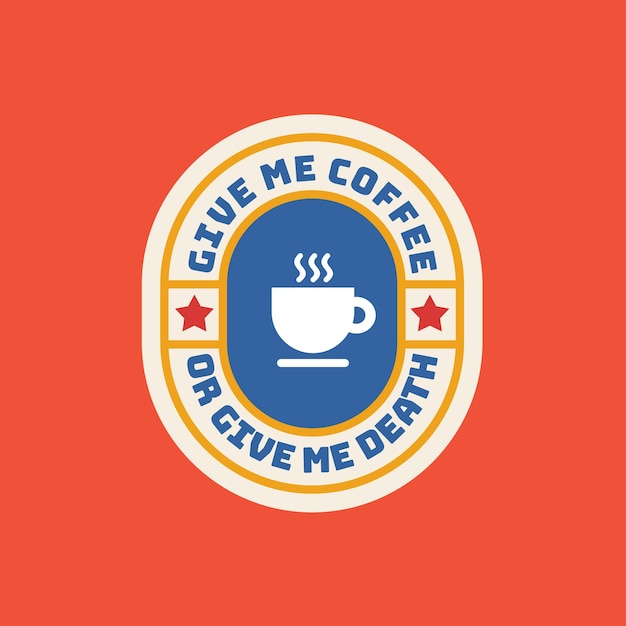
Locate an element on the screen. This screenshot has width=626, height=626. white coffee cup is located at coordinates (305, 330).